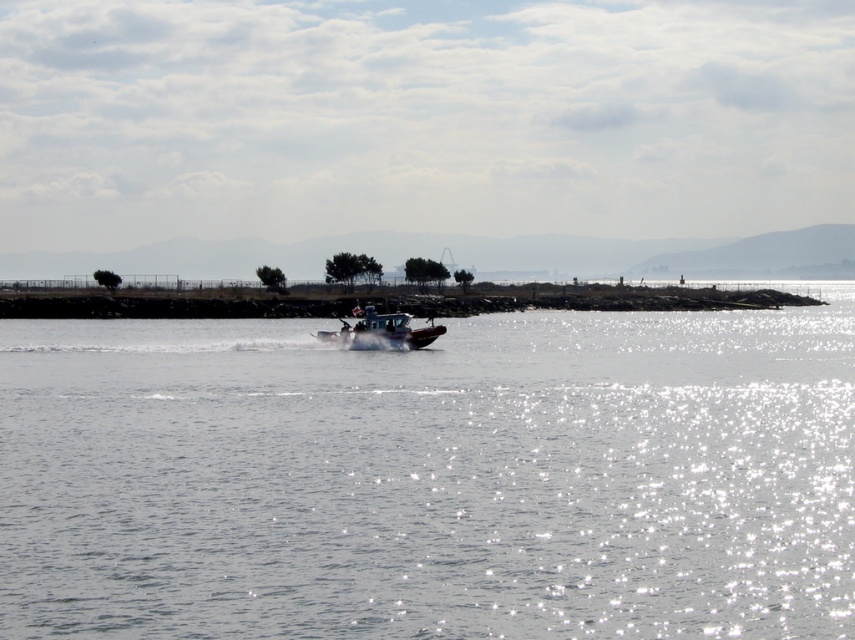
Question: Is clear water at center to the left of metallic gray boat at center from the viewer's perspective?

Choices:
 (A) no
 (B) yes

Answer: (A)

Question: Is clear water at center above metallic gray boat at center?

Choices:
 (A) no
 (B) yes

Answer: (A)

Question: Which object is closer to the camera taking this photo?

Choices:
 (A) clear water at center
 (B) metallic gray boat at center

Answer: (A)

Question: Which of the following is the closest to the observer?

Choices:
 (A) (334, 339)
 (B) (199, 595)

Answer: (B)

Question: Does clear water at center appear under metallic gray boat at center?

Choices:
 (A) yes
 (B) no

Answer: (A)

Question: Which point is farther to the camera?

Choices:
 (A) clear water at center
 (B) metallic gray boat at center

Answer: (B)